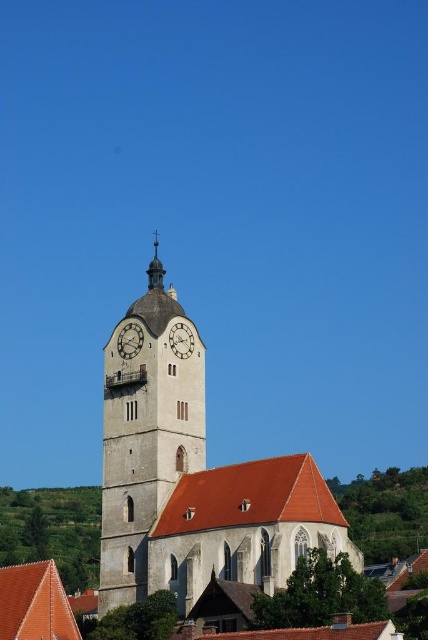
You are standing at the entrance of the matte stone church at center and want to reach the metallic clock face at center to check the time. Can you walk directly to it without any obstacles?

The matte stone church at center is 8.24 meters away from the metallic clock face at center, so yes, you can walk directly to it since there is enough space between them.

You are standing in front of the historic church and notice two points marked on the clock tower. Which point, point [183,358] or point [149,268], is closer to you?

Point [183,358] is closer to you than point [149,268].

You are standing in front of the historic church and want to take a photo of the metallic clock face at center without the matte stone church at center blocking it. Is this possible given their positions?

The matte stone church at center is in front of the metallic clock face at center, so it will block the view of the clock face. Therefore, you cannot take a photo of the metallic clock face at center without the matte stone church at center blocking it.